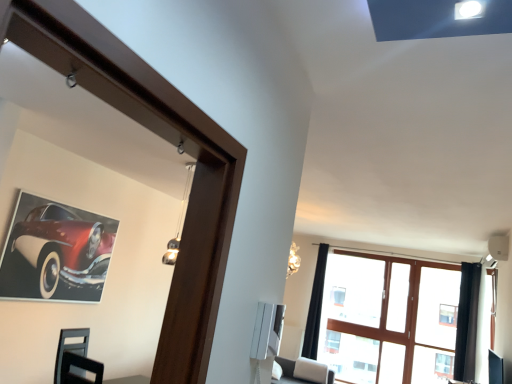
Question: Is black velvet curtain at right, which appears as the 1th curtain when viewed from the right, situated inside black fabric curtain at upper right, which ranks as the first curtain in left-to-right order, or outside?

Choices:
 (A) inside
 (B) outside

Answer: (B)

Question: Does point (461, 327) appear closer or farther from the camera than point (309, 311)?

Choices:
 (A) farther
 (B) closer

Answer: (B)

Question: Which object is the closest to the black fabric curtain at upper right, marked as the 1th curtain in a back-to-front arrangement?

Choices:
 (A) clear glass window at upper center
 (B) black velvet curtain at right, which appears as the 1th curtain when viewed from the right
 (C) shiny red car at upper left

Answer: (A)

Question: Which object is the closest to the black velvet curtain at right, which ranks as the 2th curtain in left-to-right order?

Choices:
 (A) shiny red car at upper left
 (B) black fabric curtain at upper right, which ranks as the first curtain in left-to-right order
 (C) clear glass window at upper center

Answer: (C)